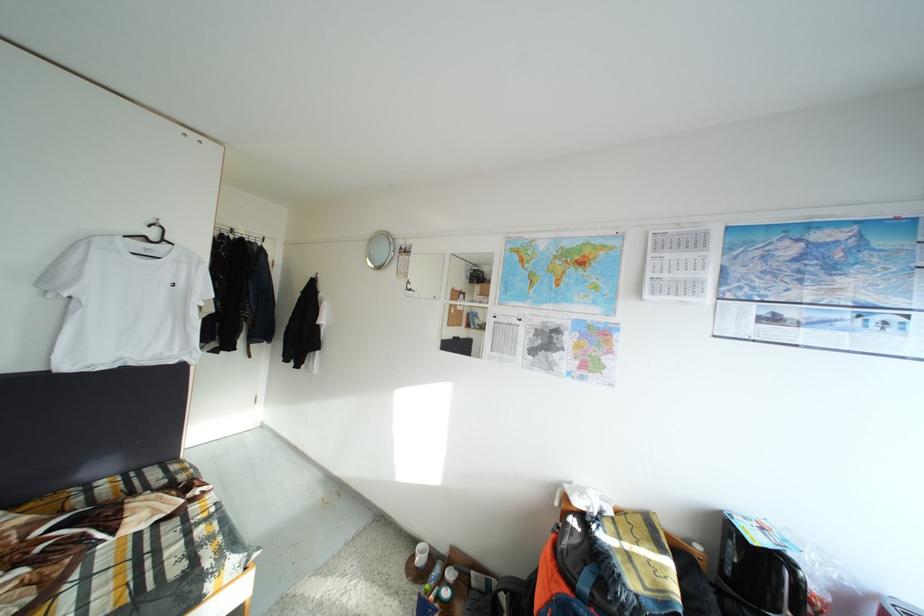
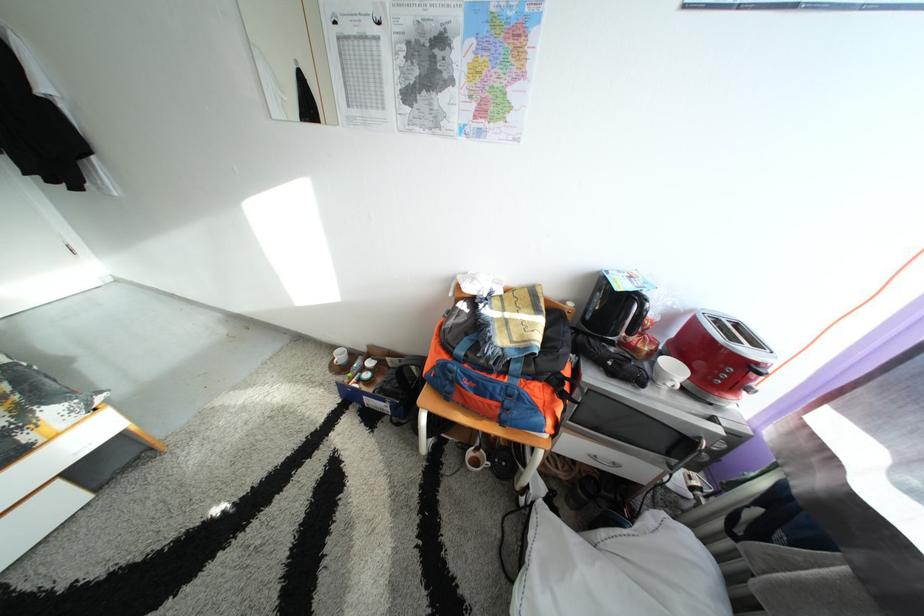
Find the pixel in the second image that matches (764,544) in the first image.

(630, 292)